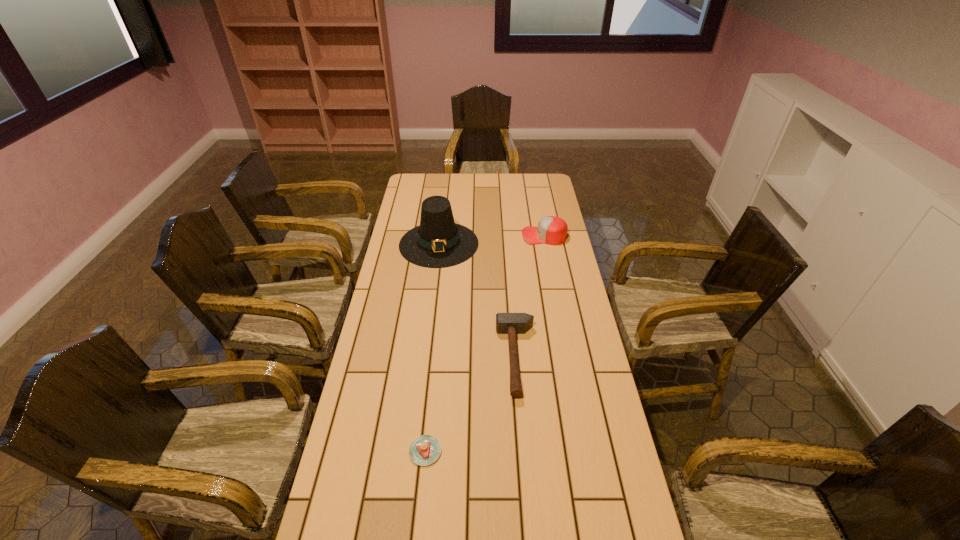
Where is `free space that satisfies the following two spatial constraints: 1. on the front-facing side of the hat; 2. on the left side of the shortest object`? This screenshot has width=960, height=540. free space that satisfies the following two spatial constraints: 1. on the front-facing side of the hat; 2. on the left side of the shortest object is located at coordinates (415, 451).

Find the location of `blank area in the image that satisfies the following two spatial constraints: 1. on the front-facing side of the tallest object; 2. on the left side of the pastry`. blank area in the image that satisfies the following two spatial constraints: 1. on the front-facing side of the tallest object; 2. on the left side of the pastry is located at coordinates (415, 451).